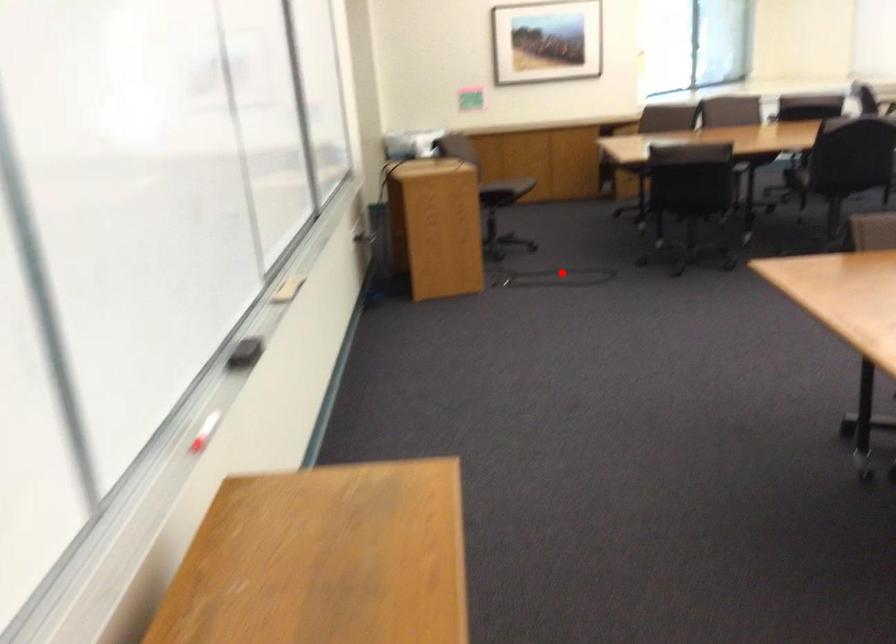
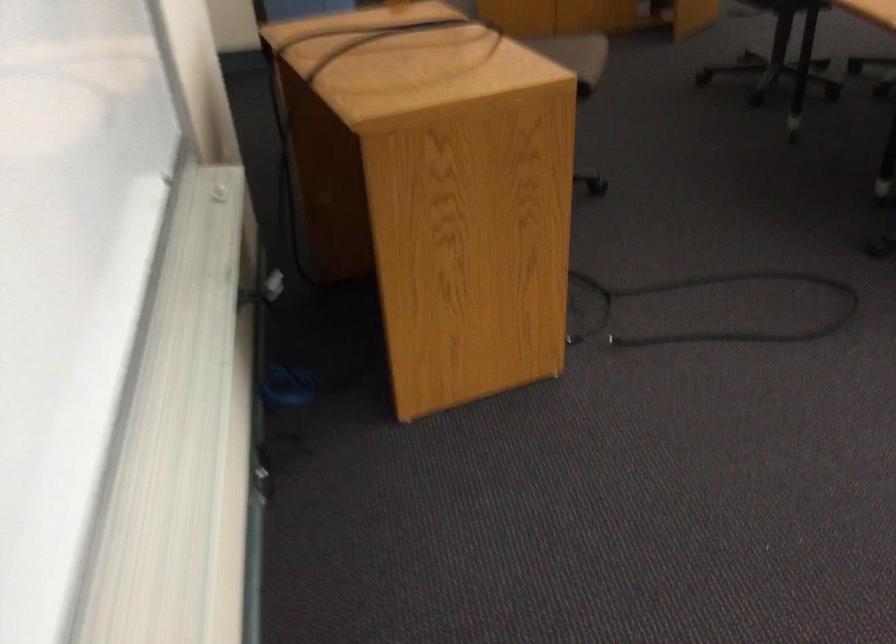
Question: I am providing you with two images of the same scene from different viewpoints. Image1 has a red point marked. In image2, the corresponding 3D location appears at what relative position? Reply with the corresponding letter.

Choices:
 (A) Closer
 (B) Farther

Answer: (A)